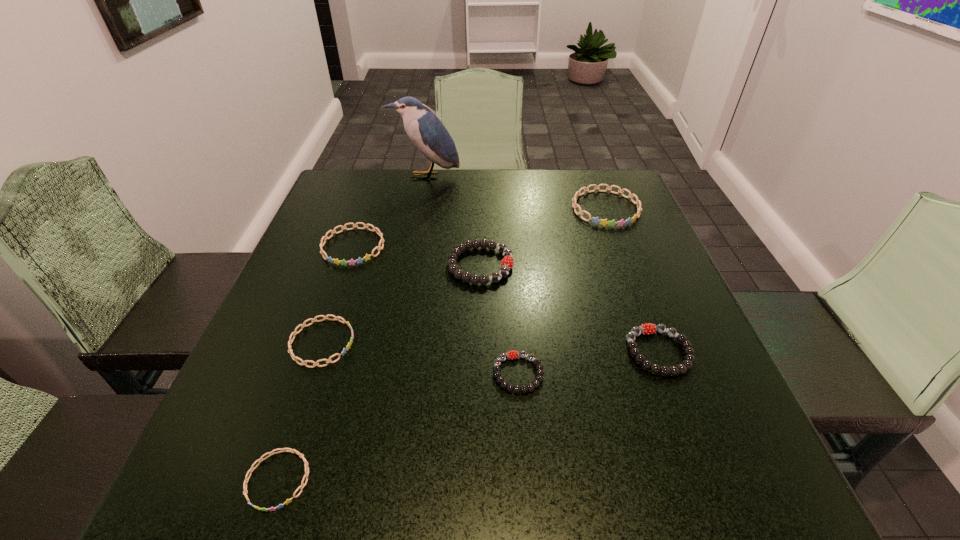
Where is `object located in the near left corner section of the desktop`? object located in the near left corner section of the desktop is located at coordinates (272, 452).

Where is `object at the far right corner`? The image size is (960, 540). object at the far right corner is located at coordinates (604, 222).

The height and width of the screenshot is (540, 960). I want to click on free space at the far edge of the desktop, so click(450, 184).

This screenshot has height=540, width=960. Identify the location of blank space at the near edge of the desktop. (372, 476).

In the image, there is a desktop. Where is `vacant space at the left edge`? The height and width of the screenshot is (540, 960). vacant space at the left edge is located at coordinates (326, 371).

Where is `free space at the right edge of the desktop`? The image size is (960, 540). free space at the right edge of the desktop is located at coordinates (650, 427).

You are a GUI agent. You are given a task and a screenshot of the screen. Output one action in this format:
    pyautogui.click(x=<x>, y=<y>)
    Task: Click on the vacant space at the far left corner
    
    Given the screenshot: What is the action you would take?
    pyautogui.click(x=352, y=212)

Locate an element on the screen. The width and height of the screenshot is (960, 540). vacant space at the near left corner is located at coordinates (270, 504).

What are the coordinates of `vacant space at the near right corner of the desktop` in the screenshot? It's located at (657, 467).

At what (x,y) coordinates should I click in order to perform the action: click on free space that is in between the smallest black bracelet and the nearest bracelet. Please return your answer as a coordinate pair (x, y). Image resolution: width=960 pixels, height=540 pixels. Looking at the image, I should click on click(x=398, y=427).